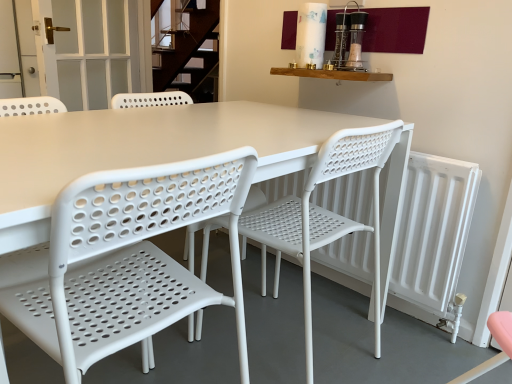
Identify the location of vacant space in front of white matte radiator at right. (369, 332).